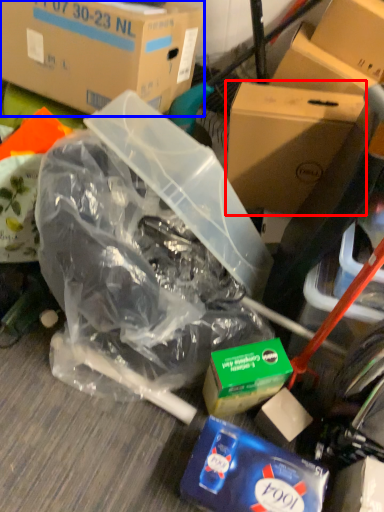
Question: Which object appears farthest to the camera in this image, box (highlighted by a red box) or box (highlighted by a blue box)?

Choices:
 (A) box
 (B) box

Answer: (A)